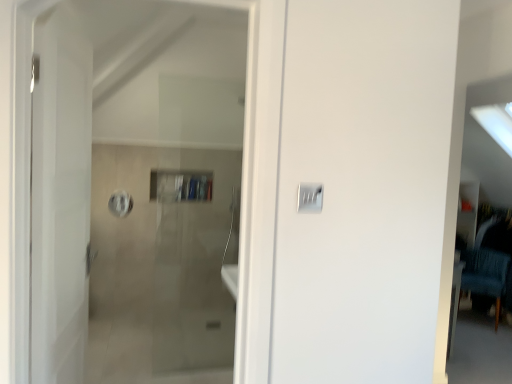
Find the location of a particular element. satin silver switch at center is located at coordinates (310, 198).

Locate an element on the screen. This screenshot has width=512, height=384. white glossy door at left is located at coordinates (60, 197).

Is blue fabric chair at right at the back of white glossy door at left?

No.

Does white glossy door at left touch blue fabric chair at right?

No, white glossy door at left is not beside blue fabric chair at right.

Considering the points (79, 290) and (482, 253), which point is behind, point (79, 290) or point (482, 253)?

The point (482, 253) is more distant.

Measure the distance from white glossy door at left to blue fabric chair at right.

white glossy door at left is 3.53 meters from blue fabric chair at right.

Which point is more forward, [302,183] or [478,275]?

The point [302,183] is closer.

From the image's perspective, is satin silver switch at center under blue fabric chair at right?

No.

Consider the image. Between satin silver switch at center and blue fabric chair at right, which one has more height?

With more height is blue fabric chair at right.

Is blue fabric chair at right surrounded by satin silver switch at center?

No, blue fabric chair at right is not inside satin silver switch at center.

From a real-world perspective, is white glossy door at left beneath satin silver switch at center?

Yes.

Consider the image. Is white glossy door at left turned away from satin silver switch at center?

No, white glossy door at left is not facing the opposite direction of satin silver switch at center.

From the image's perspective, relative to satin silver switch at center, is white glossy door at left above or below?

white glossy door at left is situated lower than satin silver switch at center in the image.

How far apart are white glossy door at left and satin silver switch at center?

A distance of 38.51 inches exists between white glossy door at left and satin silver switch at center.

The width and height of the screenshot is (512, 384). In order to click on door in front of the satin silver switch at center in this screenshot , I will do `click(60, 197)`.

Between satin silver switch at center and white glossy door at left, which one has smaller width?

Thinner between the two is satin silver switch at center.

Is satin silver switch at center not inside white glossy door at left?

Indeed, satin silver switch at center is completely outside white glossy door at left.

Looking at this image, which object is positioned more to the right, satin silver switch at center or white glossy door at left?

satin silver switch at center is more to the right.

Is blue fabric chair at right aimed at satin silver switch at center?

Yes, blue fabric chair at right is turned towards satin silver switch at center.

Would you say blue fabric chair at right is inside or outside satin silver switch at center?

blue fabric chair at right exists outside the volume of satin silver switch at center.

How far apart are blue fabric chair at right and satin silver switch at center?

They are 3.29 meters apart.

Is blue fabric chair at right far away from satin silver switch at center?

blue fabric chair at right is positioned a significant distance from satin silver switch at center.

At what (x,y) coordinates should I click in order to perform the action: click on furniture on the right of white glossy door at left. Please return your answer as a coordinate pair (x, y). The height and width of the screenshot is (384, 512). Looking at the image, I should click on coord(485,274).

Which object is wider, blue fabric chair at right or white glossy door at left?

blue fabric chair at right.

Is blue fabric chair at right not within white glossy door at left?

Yes.

Considering the sizes of objects blue fabric chair at right and white glossy door at left in the image provided, who is bigger, blue fabric chair at right or white glossy door at left?

With larger size is blue fabric chair at right.

Find the location of a particular element. The height and width of the screenshot is (384, 512). door that is above the blue fabric chair at right (from the image's perspective) is located at coordinates (60, 197).

Where is `furniture below the satin silver switch at center (from a real-world perspective)`? Image resolution: width=512 pixels, height=384 pixels. furniture below the satin silver switch at center (from a real-world perspective) is located at coordinates (485, 274).

Considering their positions, is satin silver switch at center positioned further to blue fabric chair at right than white glossy door at left?

white glossy door at left lies further to blue fabric chair at right than the other object.

Which object lies further to the anchor point white glossy door at left, satin silver switch at center or blue fabric chair at right?

blue fabric chair at right.

When comparing their distances from satin silver switch at center, does blue fabric chair at right or white glossy door at left seem closer?

The object closer to satin silver switch at center is white glossy door at left.

Estimate the real-world distances between objects in this image. Which object is closer to satin silver switch at center, white glossy door at left or blue fabric chair at right?

white glossy door at left lies closer to satin silver switch at center than the other object.

Which object lies further to the anchor point white glossy door at left, blue fabric chair at right or satin silver switch at center?

blue fabric chair at right lies further to white glossy door at left than the other object.

Considering their positions, is white glossy door at left positioned further to blue fabric chair at right than satin silver switch at center?

Among the two, white glossy door at left is located further to blue fabric chair at right.

The width and height of the screenshot is (512, 384). What are the coordinates of `light switch between white glossy door at left and blue fabric chair at right in the horizontal direction` in the screenshot? It's located at (310, 198).